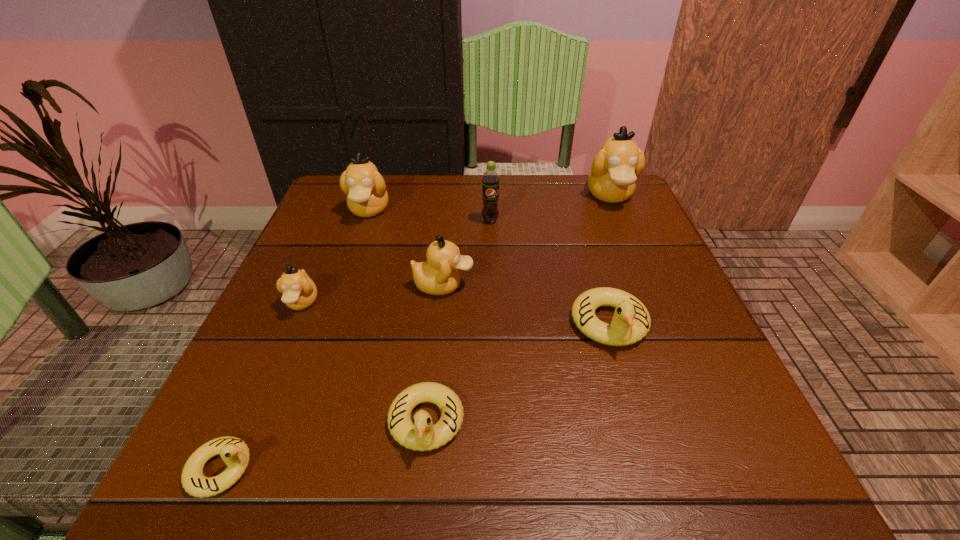
The height and width of the screenshot is (540, 960). I want to click on the tallest duckling, so click(614, 171).

Find the location of a particular element. the rightmost tan duckling is located at coordinates (614, 171).

At what (x,y) coordinates should I click in order to perform the action: click on the third smallest tan duckling. Please return your answer as a coordinate pair (x, y). The height and width of the screenshot is (540, 960). Looking at the image, I should click on (365, 188).

Locate an element on the screen. This screenshot has width=960, height=540. green soda is located at coordinates (490, 181).

What are the coordinates of `soda` in the screenshot? It's located at (490, 181).

Image resolution: width=960 pixels, height=540 pixels. I want to click on the fifth shortest duckling, so click(x=439, y=275).

I want to click on the second smallest tan duckling, so click(439, 275).

Find the location of `the biggest yellow duckling`. the biggest yellow duckling is located at coordinates (631, 321).

The image size is (960, 540). What are the coordinates of `the farthest yellow duckling` in the screenshot? It's located at (631, 321).

Locate an element on the screen. the smallest tan duckling is located at coordinates (299, 291).